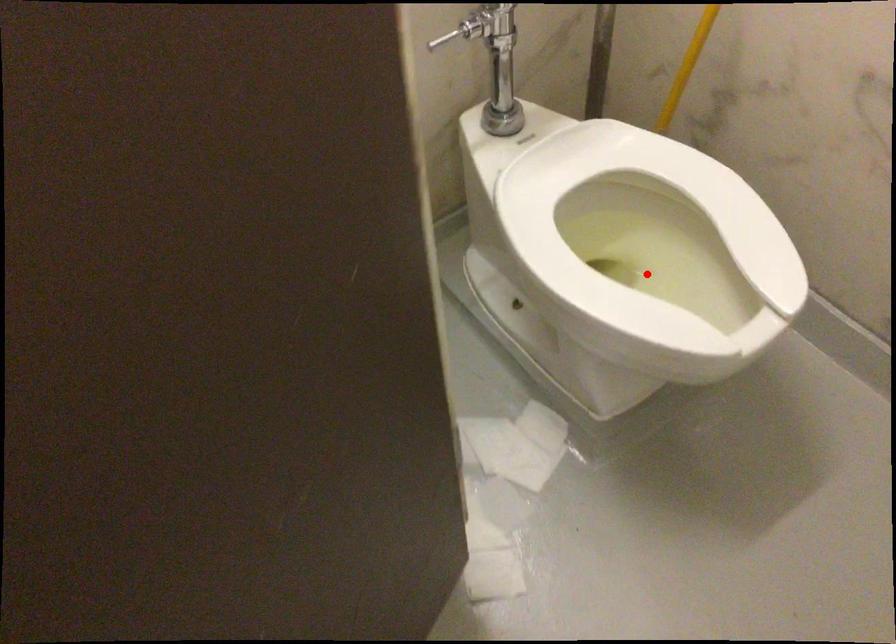
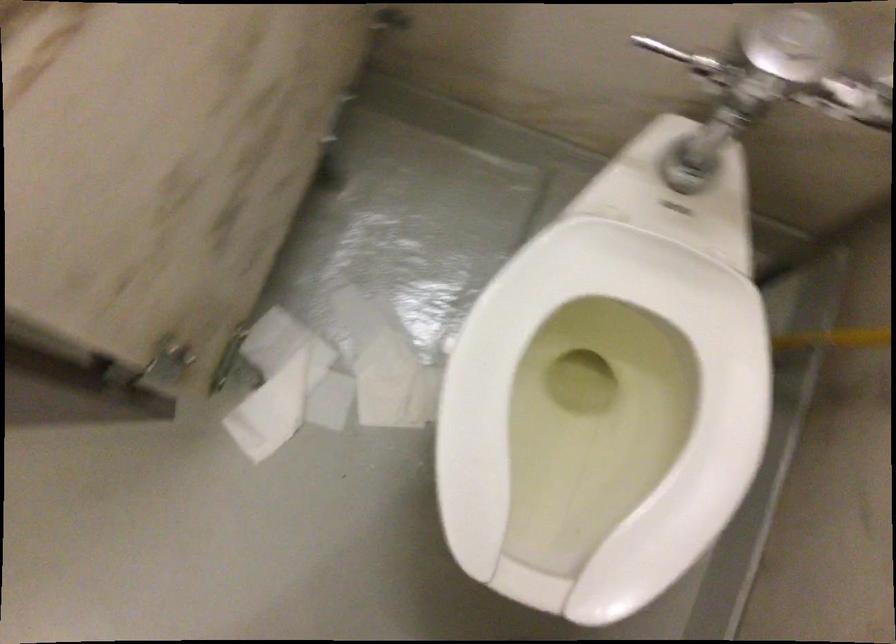
Where in the second image is the point corresponding to the highlighted location from the first image?

(600, 415)